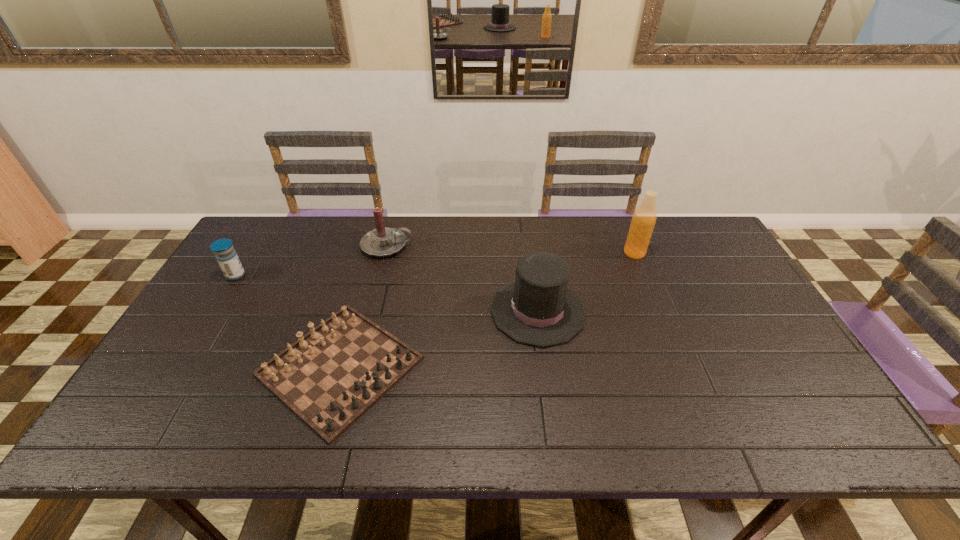
Identify the location of the rightmost object. (643, 221).

The height and width of the screenshot is (540, 960). What are the coordinates of `the tallest object` in the screenshot? It's located at (643, 221).

This screenshot has width=960, height=540. I want to click on the second object from right to left, so click(537, 308).

Locate an element on the screen. The image size is (960, 540). candle is located at coordinates (383, 241).

Find the location of `the leftmost object`. the leftmost object is located at coordinates click(x=227, y=258).

At what (x,y) coordinates should I click in order to perform the action: click on medicine. Please return your answer as a coordinate pair (x, y). This screenshot has height=540, width=960. Looking at the image, I should click on (227, 258).

Where is `chessboard`? This screenshot has height=540, width=960. chessboard is located at coordinates (331, 376).

Where is `free space located on the front of the rightmost object`? Image resolution: width=960 pixels, height=540 pixels. free space located on the front of the rightmost object is located at coordinates (670, 339).

Identify the location of vacant space situated on the front of the dress hat with the decoration. This screenshot has height=540, width=960. (462, 311).

The image size is (960, 540). Identify the location of vacant point located 0.310m on the front of the dress hat with the decoration. (380, 311).